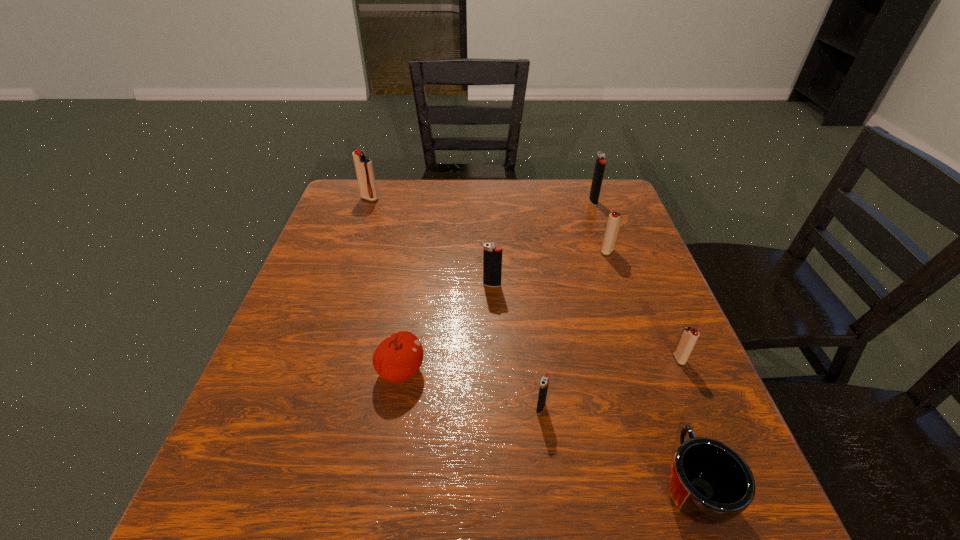
At what (x,y) coordinates should I click in order to perform the action: click on free space located 0.370m on the back of the red apple. Please return your answer as a coordinate pair (x, y). Looking at the image, I should click on (422, 240).

This screenshot has height=540, width=960. What are the coordinates of `free space located on the back of the nearest red igniter` in the screenshot? It's located at (643, 273).

You are a GUI agent. You are given a task and a screenshot of the screen. Output one action in this format:
    pyautogui.click(x=<x>, y=<y>)
    Task: Click on the free space located 0.300m on the left of the second nearest object
    The width and height of the screenshot is (960, 540).
    Given the screenshot: What is the action you would take?
    pyautogui.click(x=368, y=407)

The height and width of the screenshot is (540, 960). I want to click on free space located on the side of the nearest object with the handle, so click(x=625, y=295).

What are the coordinates of `free space located on the side of the nearest object with the handle` in the screenshot? It's located at (640, 340).

I want to click on vacant position located 0.150m on the side of the nearest object with the handle, so click(651, 368).

Find the location of a particular element. This screenshot has width=960, height=540. object at the near edge is located at coordinates (709, 483).

At what (x,y) coordinates should I click in order to perform the action: click on object present at the left edge. Please return your answer as a coordinate pair (x, y). Image resolution: width=960 pixels, height=540 pixels. Looking at the image, I should click on (364, 169).

Locate an element on the screen. This screenshot has height=540, width=960. mug that is at the right edge is located at coordinates (709, 483).

This screenshot has width=960, height=540. In order to click on object positioned at the far left corner in this screenshot , I will do `click(364, 169)`.